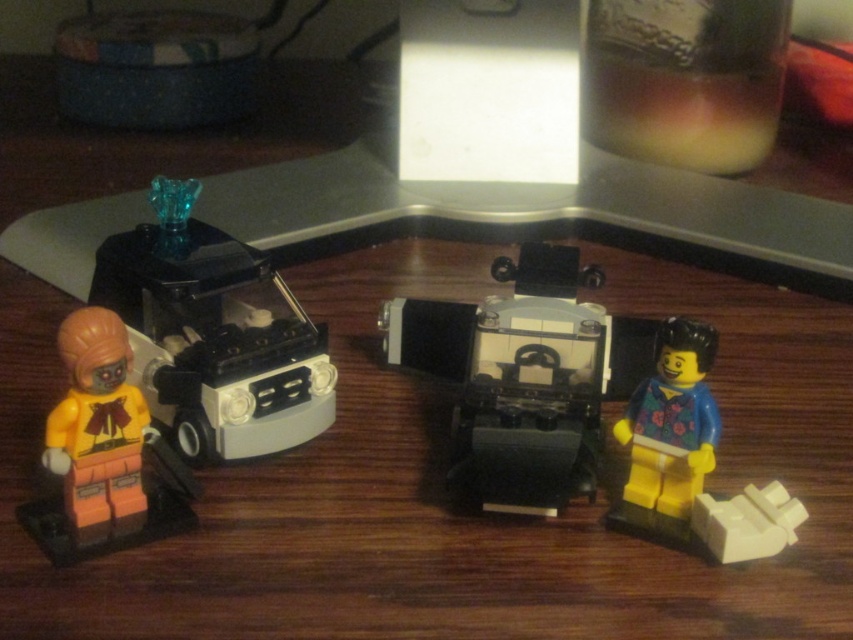
You are a LEGO enthusiast who wants to place a new LEGO set between the orange matte minifigure at lower left and the blue fabric minifigure at right. The new set requires a space where the taller figure is on the right. Is the current arrangement suitable?

The blue fabric minifigure at right is taller than the orange matte minifigure at lower left, so the current arrangement is suitable because the taller figure is already on the right.

You are a toy organizer who needs to place a new LEGO set between the orange matte minifigure at lower left and the blue fabric minifigure at right. The new set requires 20 inches of space. Can you fit it between them?

The orange matte minifigure at lower left and blue fabric minifigure at right are 20.50 inches apart from each other. Since the new LEGO set requires 20 inches of space, it can fit between them as there is enough space.